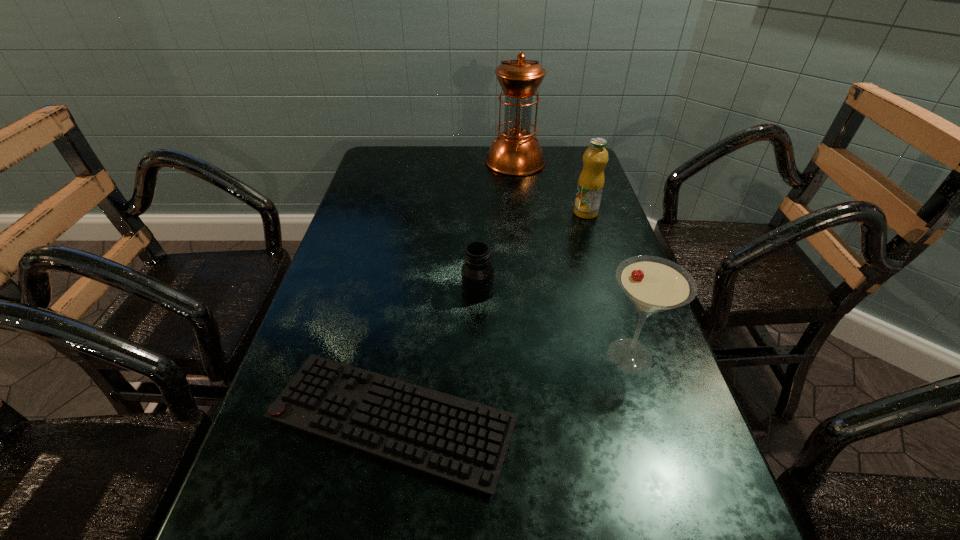
You are a GUI agent. You are given a task and a screenshot of the screen. Output one action in this format:
    pyautogui.click(x=<x>, y=<y>)
    Task: Click on the vacant area located 0.280m on the front of the jar
    The image size is (960, 540).
    Given the screenshot: What is the action you would take?
    pyautogui.click(x=477, y=416)

At what (x,y) coordinates should I click in order to perform the action: click on vacant position located 0.330m on the back of the shortest object. Please return your answer as a coordinate pair (x, y). This screenshot has height=540, width=960. Looking at the image, I should click on (420, 254).

Where is `object that is at the far edge`? This screenshot has height=540, width=960. object that is at the far edge is located at coordinates (516, 151).

You are a GUI agent. You are given a task and a screenshot of the screen. Output one action in this format:
    pyautogui.click(x=<x>, y=<y>)
    Task: Click on the object at the left edge
    The width and height of the screenshot is (960, 540).
    Given the screenshot: What is the action you would take?
    tap(464, 442)

Identify the location of oil lamp that is positioned at the right edge. The width and height of the screenshot is (960, 540). (516, 151).

Locate an element on the screen. fruit juice that is at the right edge is located at coordinates (591, 181).

This screenshot has height=540, width=960. I want to click on martini that is at the right edge, so click(653, 284).

Identify the location of object located at the far right corner. (516, 151).

Image resolution: width=960 pixels, height=540 pixels. In order to click on vacant region at the left edge of the desktop in this screenshot , I will do `click(245, 519)`.

Locate an element on the screen. The width and height of the screenshot is (960, 540). vacant space at the right edge is located at coordinates (570, 198).